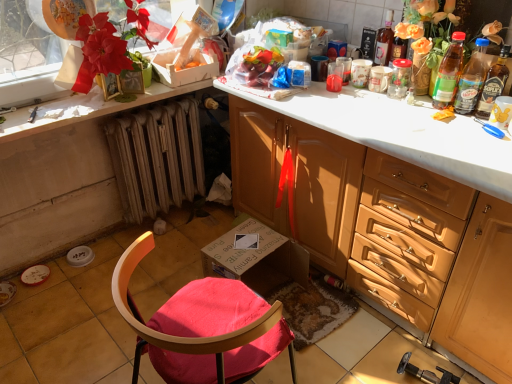
Question: In the image, is wooden chair at lower center on the left side or the right side of matte wood cabinet at center?

Choices:
 (A) right
 (B) left

Answer: (B)

Question: Considering the positions of wooden chair at lower center and matte wood cabinet at center in the image, is wooden chair at lower center taller or shorter than matte wood cabinet at center?

Choices:
 (A) tall
 (B) short

Answer: (B)

Question: Estimate the real-world distances between objects in this image. Which object is closer to the translucent plastic bottle at upper right, the 1th bottle when ordered from right to left?

Choices:
 (A) matte wood cabinet at center
 (B) translucent plastic bottle at upper right, which is the third bottle from left to right
 (C) translucent plastic bottle at upper center, which is counted as the first bottle, starting from the left
 (D) translucent plastic bottle at upper right, marked as the 3th bottle in a right-to-left arrangement
 (E) wooden radiator at lower left

Answer: (B)

Question: Which object is positioned closest to the wooden chair at lower center?

Choices:
 (A) matte wood cabinet at center
 (B) white glossy countertop at upper left
 (C) wooden radiator at lower left
 (D) translucent plastic bottle at upper center, which is the 4th bottle in right-to-left order
 (E) translucent plastic bottle at upper right, which appears as the second bottle when viewed from the left

Answer: (A)